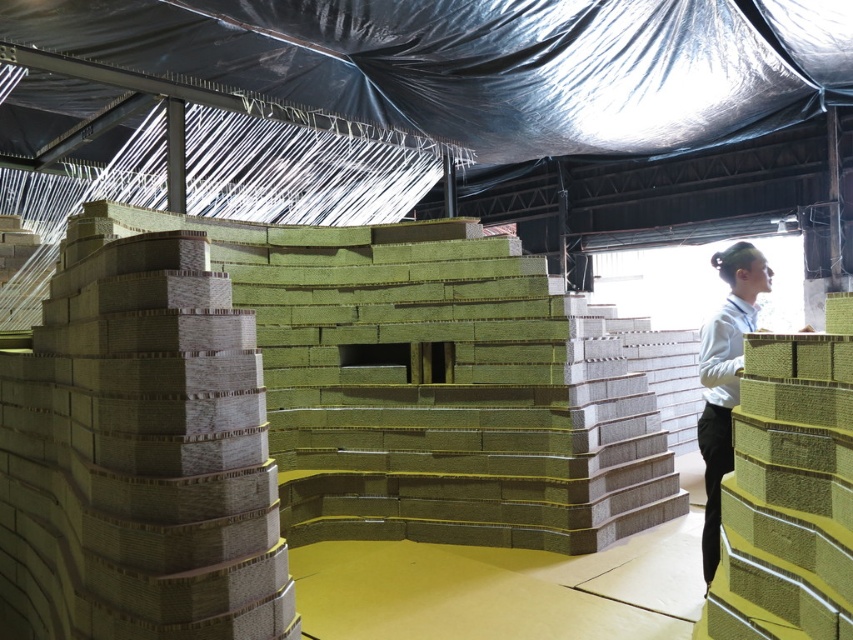
You are an architect analyzing the model. The coordinate system is set such that the bottom left corner of the image is the origin point. The model is placed in the center of the image. Where is the matte cardboard stack at left located in terms of coordinates?

The matte cardboard stack at left is located at coordinates point (138, 452).